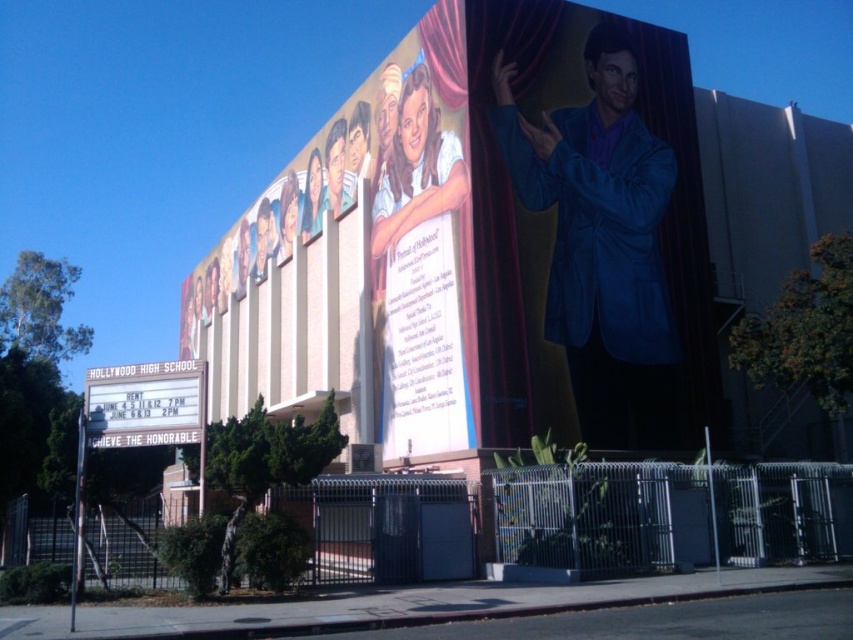
Question: Which point is closer to the camera taking this photo?

Choices:
 (A) (602, 417)
 (B) (194, 419)

Answer: (B)

Question: Is blue glossy suit at upper right wider than white marquee sign at lower left?

Choices:
 (A) no
 (B) yes

Answer: (B)

Question: Which of the following is the closest to the observer?

Choices:
 (A) (126, 417)
 (B) (618, 392)
 (C) (584, 170)

Answer: (A)

Question: Is blue velvet suit at right to the right of white marquee sign at lower left from the viewer's perspective?

Choices:
 (A) yes
 (B) no

Answer: (A)

Question: Does blue velvet suit at right appear on the right side of white marquee sign at lower left?

Choices:
 (A) no
 (B) yes

Answer: (B)

Question: Which object is the farthest from the white marquee sign at lower left?

Choices:
 (A) blue glossy suit at upper right
 (B) blue velvet suit at right

Answer: (B)